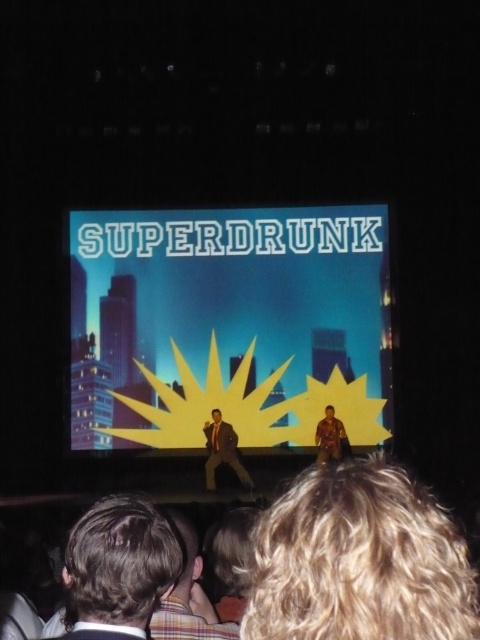
In the scene shown: Is brown hair at lower left positioned before plaid fabric shirt at lower center?

Yes.

In order to click on brown hair at lower left in this screenshot , I will do `click(118, 568)`.

Is blonde hair at lower center bigger than camouflage-patterned shirt at center?

Yes, blonde hair at lower center is bigger than camouflage-patterned shirt at center.

Is blonde hair at lower center wider than camouflage-patterned shirt at center?

Correct, the width of blonde hair at lower center exceeds that of camouflage-patterned shirt at center.

Which is in front, point (418, 528) or point (328, 454)?

Positioned in front is point (418, 528).

This screenshot has width=480, height=640. Find the location of `blonde hair at lower center`. blonde hair at lower center is located at coordinates (359, 561).

Measure the distance between plaid fabric shirt at lower center and camera.

plaid fabric shirt at lower center and camera are 55.35 meters apart from each other.

Who is shorter, plaid fabric shirt at lower center or camouflage-patterned shirt at center?

camouflage-patterned shirt at center

Who is more distant from viewer, (196, 540) or (336, 444)?

Positioned behind is point (336, 444).

This screenshot has height=640, width=480. I want to click on plaid fabric shirt at lower center, so click(x=188, y=595).